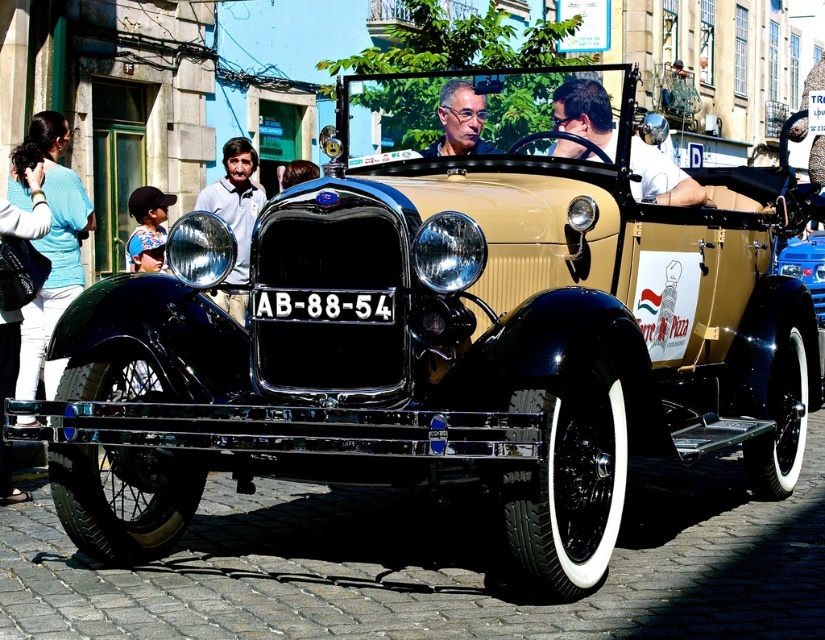
Question: Among these objects, which one is nearest to the camera?

Choices:
 (A) matte black face at center
 (B) blue glossy car at center

Answer: (A)

Question: Is matte black shirt at center to the left of matte white shirt at center from the viewer's perspective?

Choices:
 (A) no
 (B) yes

Answer: (A)

Question: Among these objects, which one is nearest to the camera?

Choices:
 (A) matte white shirt at center
 (B) matte black shirt at center
 (C) matte black face at center

Answer: (B)

Question: Which of these objects is positioned farthest from the matte black shirt at center?

Choices:
 (A) blue glossy car at center
 (B) matte white shirt at center

Answer: (B)

Question: Is matte black shirt at center above blue glossy car at center?

Choices:
 (A) no
 (B) yes

Answer: (B)

Question: Can you confirm if matte white shirt at center is positioned to the left of matte black face at center?

Choices:
 (A) yes
 (B) no

Answer: (A)